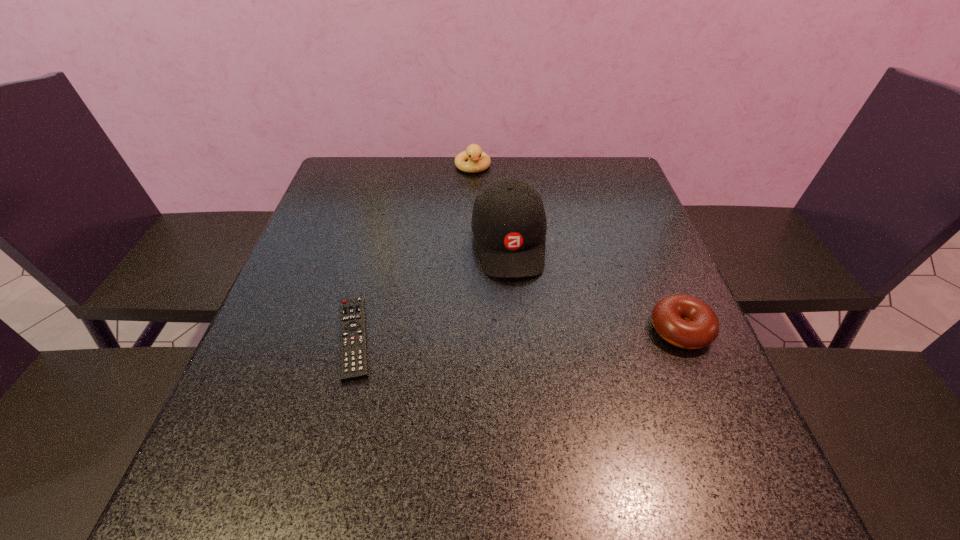
Identify the location of free space located 0.180m with a logo on the front of the third nearest object. The image size is (960, 540). (524, 346).

Find the location of `vacant space located 0.170m with a logo on the front of the third nearest object`. vacant space located 0.170m with a logo on the front of the third nearest object is located at coordinates (524, 342).

Where is `free space located with a logo on the front of the third nearest object`? free space located with a logo on the front of the third nearest object is located at coordinates (531, 386).

The height and width of the screenshot is (540, 960). Identify the location of vacant area situated 0.210m at the beak of the farthest object. (486, 219).

This screenshot has width=960, height=540. Identify the location of vacant space located 0.250m at the beak of the farthest object. (489, 228).

What are the coordinates of `free location located at the beak of the farthest object` in the screenshot? It's located at (486, 217).

Where is `object present at the far edge`? This screenshot has width=960, height=540. object present at the far edge is located at coordinates (478, 161).

At what (x,y) coordinates should I click in order to perform the action: click on object that is at the left edge. Please return your answer as a coordinate pair (x, y). Image resolution: width=960 pixels, height=540 pixels. Looking at the image, I should click on (353, 346).

Where is `object at the right edge`? This screenshot has height=540, width=960. object at the right edge is located at coordinates (684, 321).

What are the coordinates of `vacant region at the far edge of the desktop` in the screenshot? It's located at (436, 158).